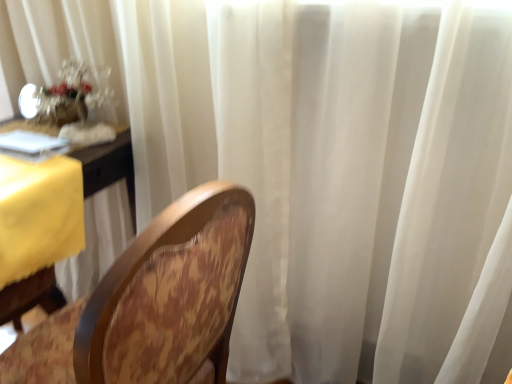
Question: Considering the positions of yellow fabric table at left and wooden chair at center in the image, is yellow fabric table at left taller or shorter than wooden chair at center?

Choices:
 (A) tall
 (B) short

Answer: (B)

Question: Is yellow fabric table at left inside the boundaries of wooden chair at center, or outside?

Choices:
 (A) inside
 (B) outside

Answer: (B)

Question: Considering the real-world distances, which object is farthest from the translucent glass floral arrangement at upper left?

Choices:
 (A) wooden chair at center
 (B) yellow fabric table at left

Answer: (A)

Question: Estimate the real-world distances between objects in this image. Which object is closer to the translucent glass floral arrangement at upper left?

Choices:
 (A) wooden chair at center
 (B) yellow fabric table at left

Answer: (B)